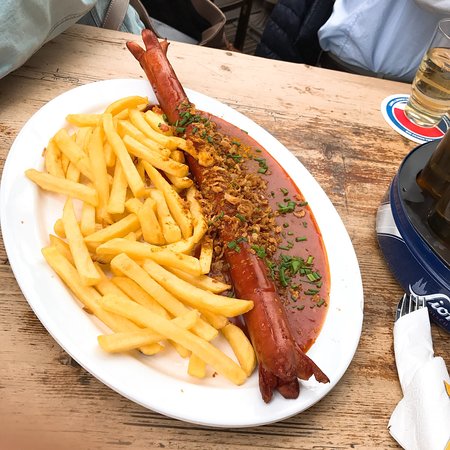
You are a GUI agent. You are given a task and a screenshot of the screen. Output one action in this format:
    pyautogui.click(x=<x>, y=<y>)
    Task: Click on the napkin
    This screenshot has height=450, width=450.
    Given the screenshot: What is the action you would take?
    pyautogui.click(x=417, y=363)